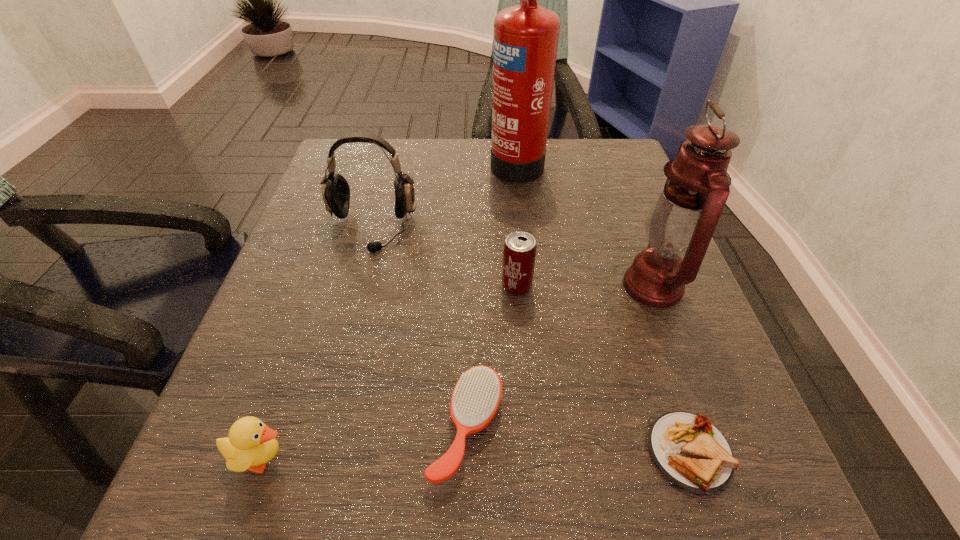
Locate an element on the screen. Image resolution: width=960 pixels, height=540 pixels. vacant space that satisfies the following two spatial constraints: 1. with the microphone on the side of the sixth nearest object; 2. on the front-facing side of the duckling is located at coordinates (311, 458).

I want to click on vacant space that satisfies the following two spatial constraints: 1. with the microphone on the side of the sixth nearest object; 2. on the front-facing side of the duckling, so click(311, 458).

Locate an element on the screen. The width and height of the screenshot is (960, 540). free location that satisfies the following two spatial constraints: 1. on the back side of the oil lamp; 2. on the right side of the beer can is located at coordinates (516, 286).

Where is `vacant space that satisfies the following two spatial constraints: 1. with the microphone on the side of the second tallest object; 2. on the right side of the fifth shortest object`? This screenshot has width=960, height=540. vacant space that satisfies the following two spatial constraints: 1. with the microphone on the side of the second tallest object; 2. on the right side of the fifth shortest object is located at coordinates pos(356,286).